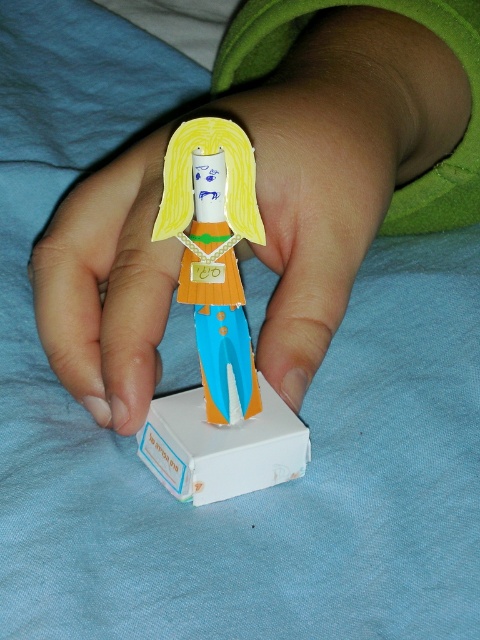
Question: Among these points, which one is nearest to the camera?

Choices:
 (A) (192, 490)
 (B) (254, 236)
 (C) (83, 292)

Answer: (B)

Question: Can you confirm if matte paper doll at center is positioned to the left of white cardboard box at center?

Choices:
 (A) yes
 (B) no

Answer: (B)

Question: Among these points, which one is farthest from the camera?

Choices:
 (A) (240, 481)
 (B) (216, 179)
 (C) (312, 180)

Answer: (C)

Question: Does matte paper doll at center lie behind cardboard doll at center?

Choices:
 (A) no
 (B) yes

Answer: (B)

Question: Which of the following is the farthest from the observer?

Choices:
 (A) (300, 422)
 (B) (166, 420)

Answer: (A)

Question: Observing the image, what is the correct spatial positioning of cardboard doll at center in reference to white cardboard box at center?

Choices:
 (A) below
 (B) above

Answer: (B)